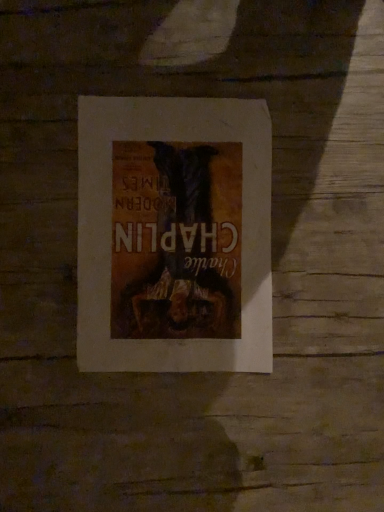
The width and height of the screenshot is (384, 512). What are the coordinates of `matte paper poster at center` in the screenshot? It's located at (174, 234).

Image resolution: width=384 pixels, height=512 pixels. What do you see at coordinates (174, 234) in the screenshot?
I see `matte paper poster at center` at bounding box center [174, 234].

What is the approximate height of matte paper poster at center?

matte paper poster at center is 0.70 inches in height.

Locate an element on the screen. The image size is (384, 512). matte paper poster at center is located at coordinates (174, 234).